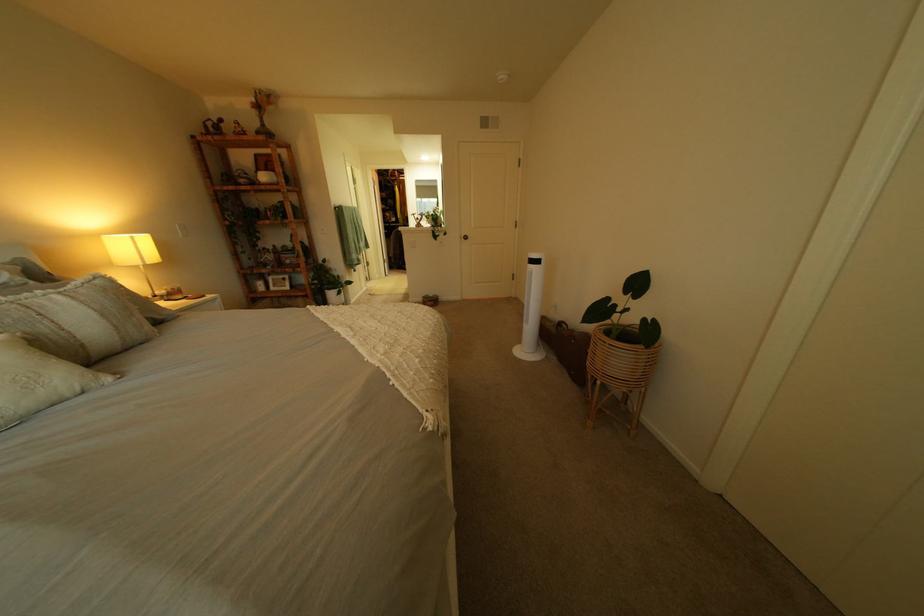
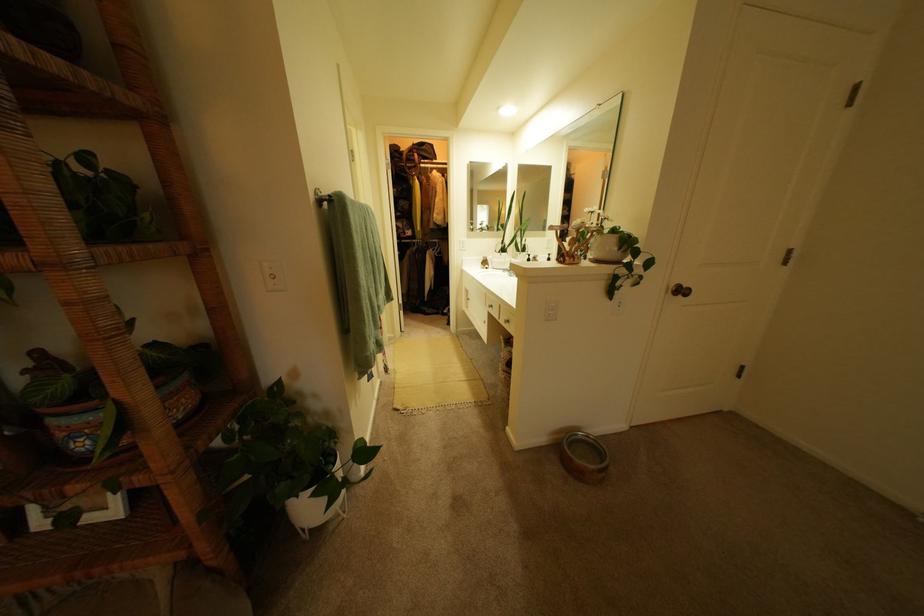
Which direction would the cameraman need to move to produce the second image?

The cameraman walked toward left, forward.